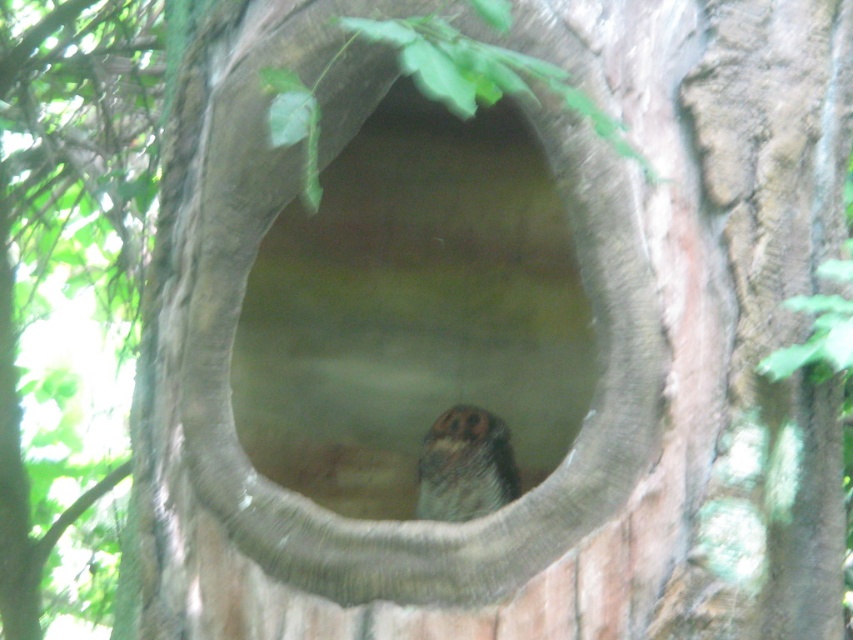
Question: Is smooth concrete hole at center smaller than brown speckled owl at center?

Choices:
 (A) no
 (B) yes

Answer: (A)

Question: Can you confirm if smooth concrete hole at center is positioned to the right of brown speckled owl at center?

Choices:
 (A) yes
 (B) no

Answer: (B)

Question: Is smooth concrete hole at center wider than brown speckled owl at center?

Choices:
 (A) no
 (B) yes

Answer: (B)

Question: Which object is closer to the camera taking this photo?

Choices:
 (A) brown speckled owl at center
 (B) smooth concrete hole at center

Answer: (A)